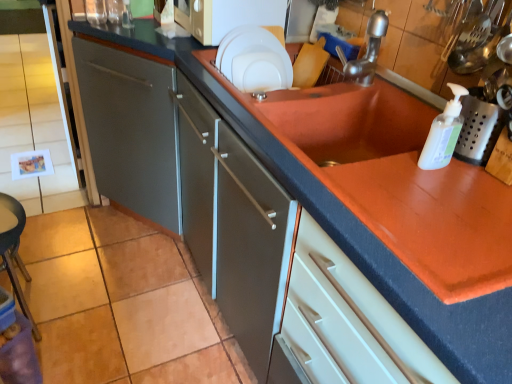
The height and width of the screenshot is (384, 512). I want to click on free space in front of white plastic soap dispenser at upper right, so pos(441,208).